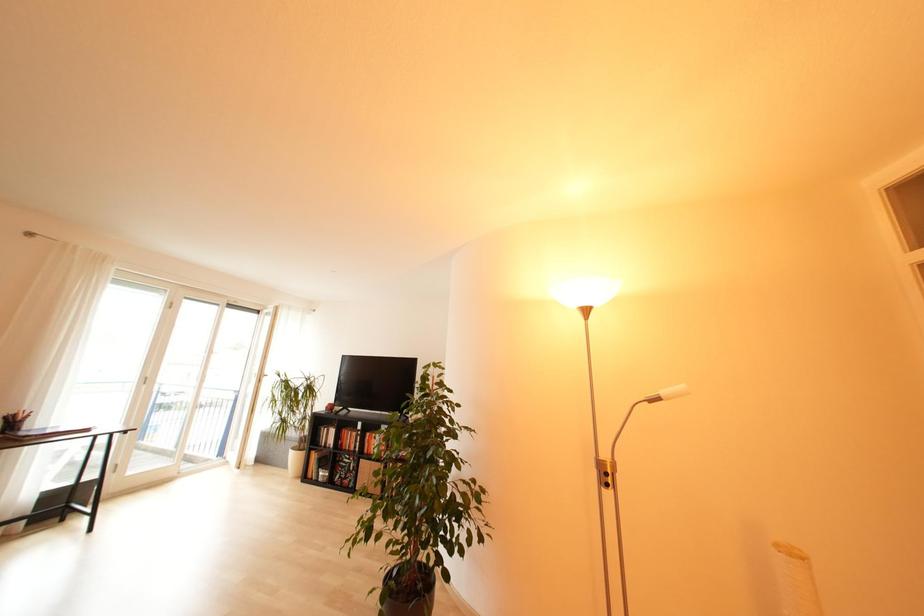
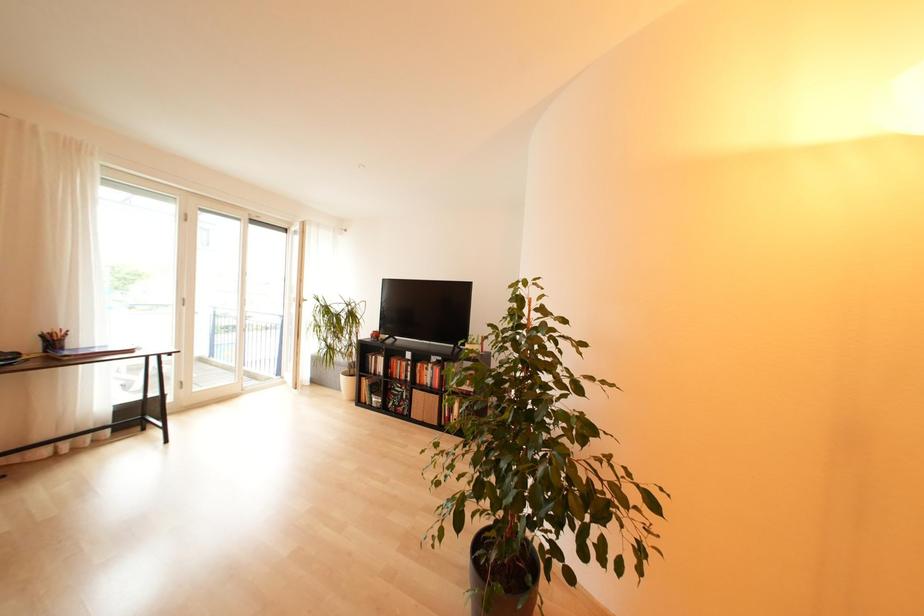
What movement of the cameraman would produce the second image?

The cameraman walked toward left, forward.